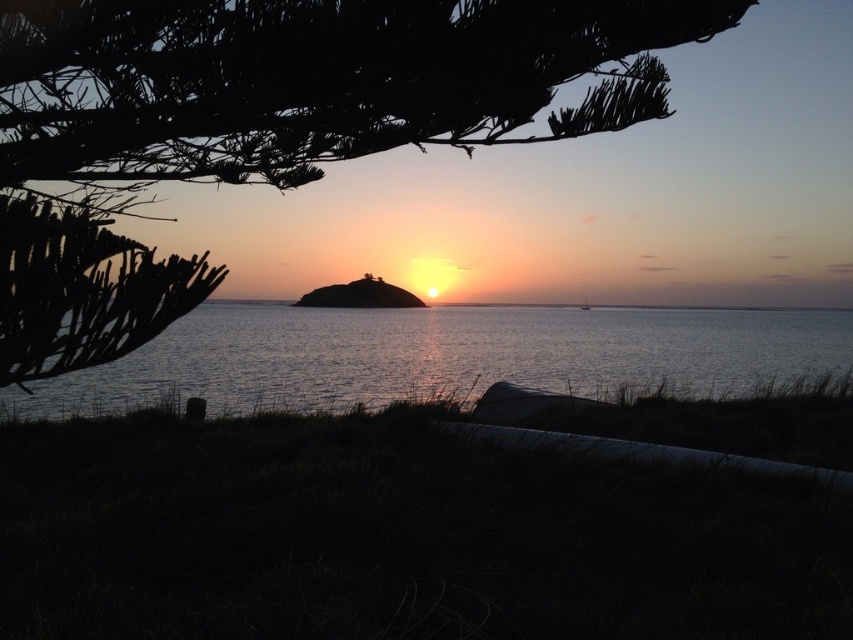
Is green leafy tree at upper left above white glossy boat at center?

Yes, green leafy tree at upper left is above white glossy boat at center.

Where is `green leafy tree at upper left`? This screenshot has width=853, height=640. green leafy tree at upper left is located at coordinates (265, 124).

This screenshot has height=640, width=853. What are the coordinates of `green leafy tree at upper left` in the screenshot? It's located at (265, 124).

Which is more to the right, glistening silver water at center or white glossy boat at center?

Positioned to the right is white glossy boat at center.

Between glistening silver water at center and white glossy boat at center, which one has more height?

Standing taller between the two is glistening silver water at center.

Image resolution: width=853 pixels, height=640 pixels. Describe the element at coordinates (444, 355) in the screenshot. I see `glistening silver water at center` at that location.

This screenshot has height=640, width=853. Find the location of `glistening silver water at center`. glistening silver water at center is located at coordinates (444, 355).

Is point (270, 150) farther from camera compared to point (737, 355)?

No, (270, 150) is closer to viewer.

Does green leafy tree at upper left have a lesser width compared to glistening silver water at center?

Correct, green leafy tree at upper left's width is less than glistening silver water at center's.

The height and width of the screenshot is (640, 853). Find the location of `green leafy tree at upper left`. green leafy tree at upper left is located at coordinates (265, 124).

Find the location of `green leafy tree at upper left`. green leafy tree at upper left is located at coordinates (265, 124).